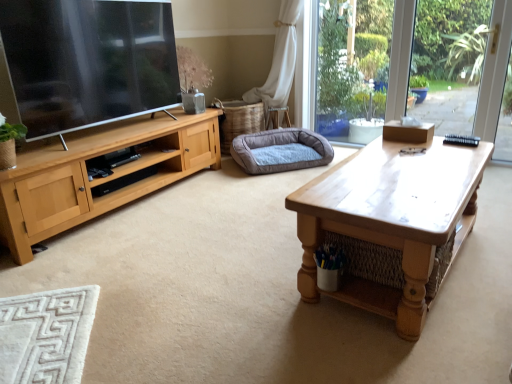
This screenshot has height=384, width=512. What are the coordinates of `free spot in front of gray fabric dog bed at center` in the screenshot? It's located at pos(251,189).